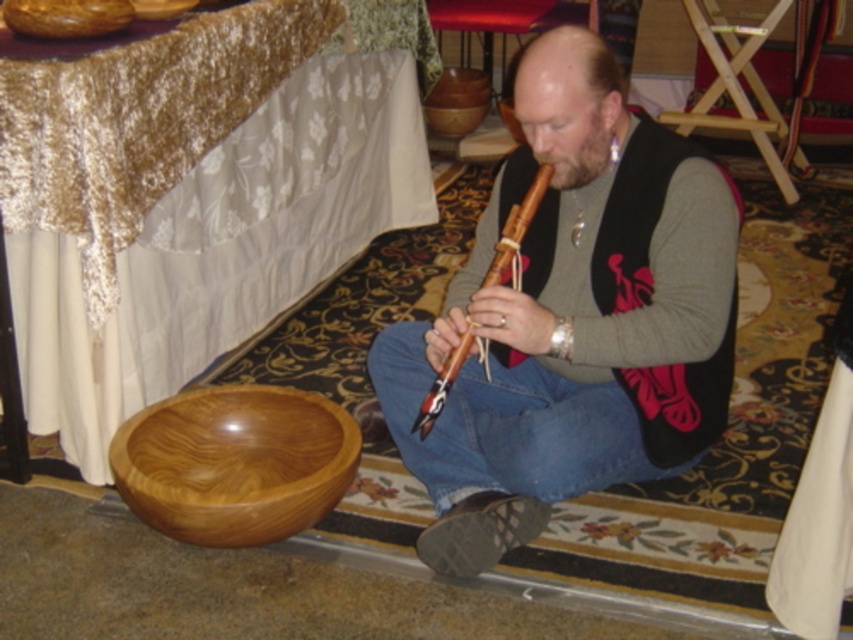
Where is the matte wood flute at center located in the image?

The matte wood flute at center is located at point (x=572, y=317).

You are a photographer taking a picture of the scene. You want to ensure both the matte wood flute at center and the shiny brown wooden bowl at lower left are in focus. Which object should you focus on first to ensure depth of field captures both?

You should focus on the shiny brown wooden bowl at lower left first because it is farther away from the camera than the matte wood flute at center, ensuring the depth of field includes both objects.